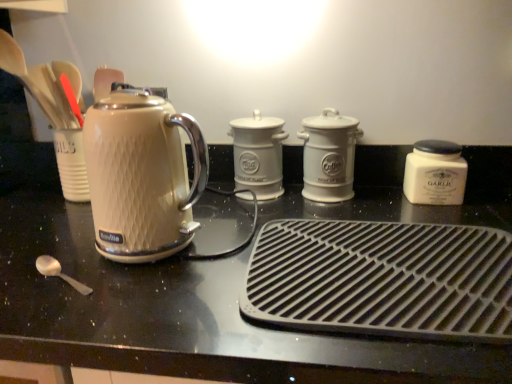
Question: Can you confirm if black rubber mat at center, placed as the fourth kitchen appliance when sorted from back to front, is thinner than white ceramic canister at center, arranged as the fourth kitchen appliance when viewed from the front?

Choices:
 (A) yes
 (B) no

Answer: (B)

Question: Does black rubber mat at center, placed as the fourth kitchen appliance when sorted from back to front, appear on the left side of white ceramic canister at center, placed as the 1th kitchen appliance when sorted from back to front?

Choices:
 (A) yes
 (B) no

Answer: (B)

Question: Is black rubber mat at center, placed as the fourth kitchen appliance when sorted from back to front, facing away from white ceramic canister at center, arranged as the fourth kitchen appliance when viewed from the front?

Choices:
 (A) no
 (B) yes

Answer: (A)

Question: Is black rubber mat at center, which is the first kitchen appliance from front to back, in contact with white ceramic canister at center, placed as the 1th kitchen appliance when sorted from back to front?

Choices:
 (A) yes
 (B) no

Answer: (B)

Question: Does black rubber mat at center, placed as the fourth kitchen appliance when sorted from back to front, have a lesser height compared to white ceramic canister at center, arranged as the fourth kitchen appliance when viewed from the front?

Choices:
 (A) no
 (B) yes

Answer: (B)

Question: Does black rubber mat at center, which is the first kitchen appliance from front to back, have a smaller size compared to white ceramic canister at center, arranged as the fourth kitchen appliance when viewed from the front?

Choices:
 (A) yes
 (B) no

Answer: (B)

Question: Is white ceramic canister at center, arranged as the fourth kitchen appliance when viewed from the front, further to camera compared to white ceramic jar at right, acting as the 2th kitchen appliance starting from the front?

Choices:
 (A) no
 (B) yes

Answer: (B)

Question: Can you confirm if white ceramic canister at center, placed as the 1th kitchen appliance when sorted from back to front, is shorter than white ceramic jar at right, which is counted as the third kitchen appliance, starting from the back?

Choices:
 (A) yes
 (B) no

Answer: (B)

Question: Could you tell me if white ceramic canister at center, arranged as the fourth kitchen appliance when viewed from the front, is facing white ceramic jar at right, acting as the 2th kitchen appliance starting from the front?

Choices:
 (A) yes
 (B) no

Answer: (B)

Question: From the image's perspective, does white ceramic canister at center, placed as the 1th kitchen appliance when sorted from back to front, appear higher than white ceramic jar at right, which is counted as the third kitchen appliance, starting from the back?

Choices:
 (A) yes
 (B) no

Answer: (A)

Question: Does white ceramic canister at center, arranged as the fourth kitchen appliance when viewed from the front, contain white ceramic jar at right, acting as the 2th kitchen appliance starting from the front?

Choices:
 (A) no
 (B) yes

Answer: (A)

Question: From the image's perspective, is white ceramic canister at center, placed as the 1th kitchen appliance when sorted from back to front, under white ceramic jar at right, which is counted as the third kitchen appliance, starting from the back?

Choices:
 (A) no
 (B) yes

Answer: (A)

Question: Is matte white kettle at left thinner than white ceramic coffee canister at center, the 3th kitchen appliance viewed from the front?

Choices:
 (A) yes
 (B) no

Answer: (B)